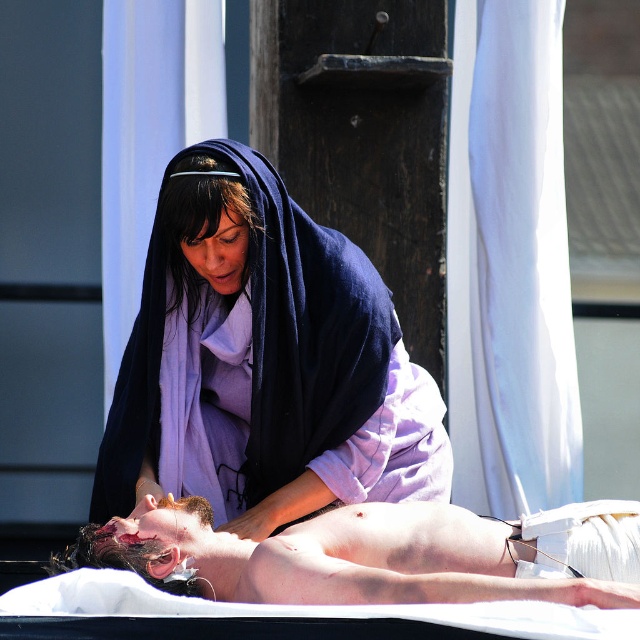
Question: Which of the following is the closest to the observer?

Choices:
 (A) matte purple robe at center
 (B) smooth skin body at center

Answer: (B)

Question: Is matte purple robe at center wider than smooth skin body at center?

Choices:
 (A) no
 (B) yes

Answer: (A)

Question: Which object is closer to the camera taking this photo?

Choices:
 (A) smooth skin body at center
 (B) matte purple robe at center

Answer: (A)

Question: Is matte purple robe at center wider than smooth skin body at center?

Choices:
 (A) no
 (B) yes

Answer: (A)

Question: Is matte purple robe at center positioned at the back of smooth skin body at center?

Choices:
 (A) yes
 (B) no

Answer: (A)